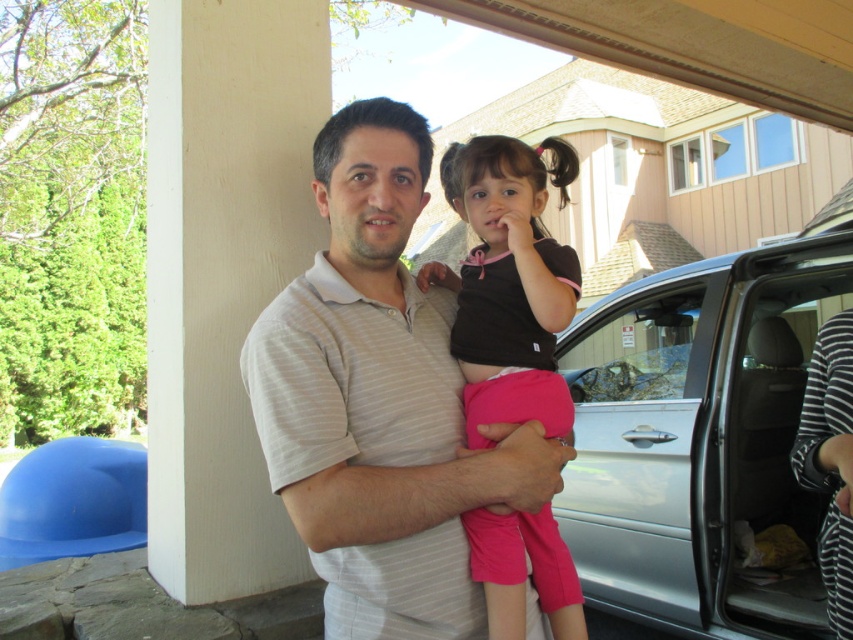
Question: Which point is farther from the camera taking this photo?

Choices:
 (A) (643, 280)
 (B) (488, 301)
 (C) (376, 138)

Answer: (A)

Question: Which object appears closest to the camera in this image?

Choices:
 (A) striped cotton shirt at center
 (B) silver metallic car at right

Answer: (A)

Question: Does striped cotton shirt at center have a greater width compared to black matte shirt at center?

Choices:
 (A) no
 (B) yes

Answer: (B)

Question: Which is nearer to the striped cotton shirt at center?

Choices:
 (A) silver metallic car at right
 (B) black matte shirt at center

Answer: (B)

Question: Does silver metallic car at right appear over black matte shirt at center?

Choices:
 (A) yes
 (B) no

Answer: (B)

Question: Does striped cotton shirt at center appear on the left side of black matte shirt at center?

Choices:
 (A) yes
 (B) no

Answer: (A)